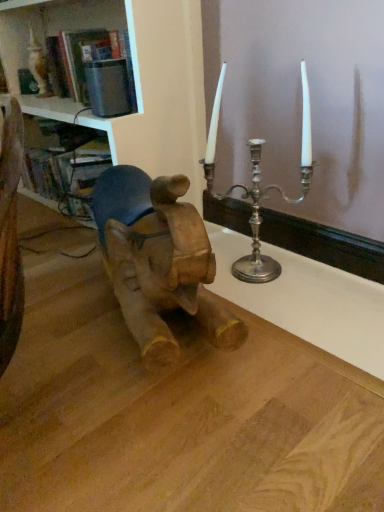
Locate an element on the screen. This screenshot has width=384, height=512. vacant area that is in front of wooden baby elephant at left is located at coordinates (160, 426).